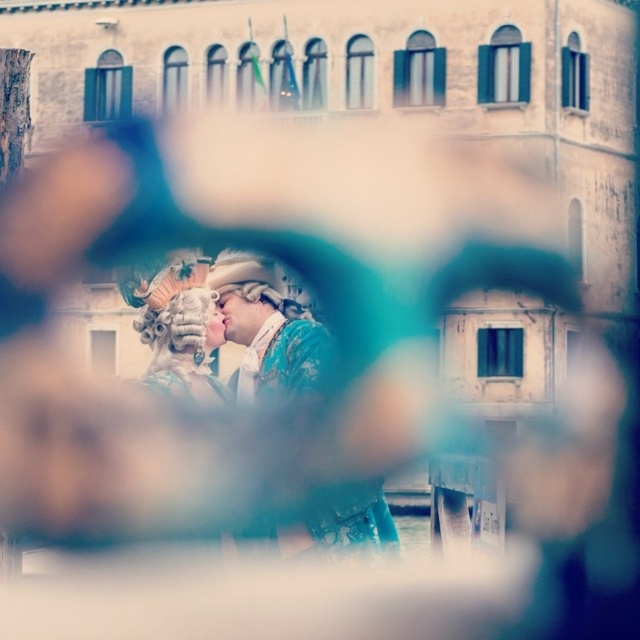
Question: Which of the following is the closest to the observer?

Choices:
 (A) (141, 337)
 (B) (304, 333)

Answer: (A)

Question: Is shiny gold mask at center positioned behind matte gold mask at center?

Choices:
 (A) no
 (B) yes

Answer: (A)

Question: Is shiny gold mask at center above matte gold mask at center?

Choices:
 (A) yes
 (B) no

Answer: (B)

Question: Among these objects, which one is nearest to the camera?

Choices:
 (A) shiny gold mask at center
 (B) matte gold mask at center

Answer: (A)

Question: Where is shiny gold mask at center located in relation to matte gold mask at center in the image?

Choices:
 (A) above
 (B) below

Answer: (B)